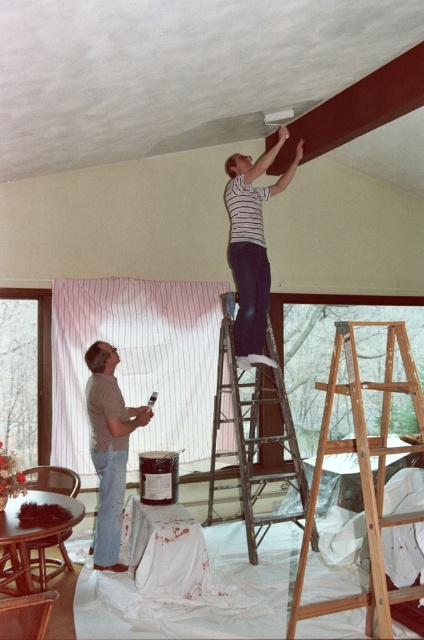
Question: Among these points, which one is nearest to the camera?

Choices:
 (A) (236, 404)
 (B) (97, 516)
 (C) (421, 449)

Answer: (C)

Question: Can you confirm if wooden ladder at center is positioned to the right of metallic silver ladder at center?

Choices:
 (A) no
 (B) yes

Answer: (B)

Question: Considering the relative positions of metallic silver ladder at center and gray matte shirt at lower left in the image provided, where is metallic silver ladder at center located with respect to gray matte shirt at lower left?

Choices:
 (A) left
 (B) right

Answer: (B)

Question: Which of the following is the farthest from the observer?

Choices:
 (A) wooden ladder at center
 (B) striped fabric at upper center
 (C) gray matte shirt at lower left

Answer: (B)

Question: Which point is closer to the camera taking this photo?

Choices:
 (A) (418, 385)
 (B) (103, 342)
 (C) (233, 516)
 (D) (262, 227)

Answer: (A)

Question: Can you confirm if metallic silver ladder at center is positioned to the left of gray matte shirt at lower left?

Choices:
 (A) no
 (B) yes

Answer: (A)